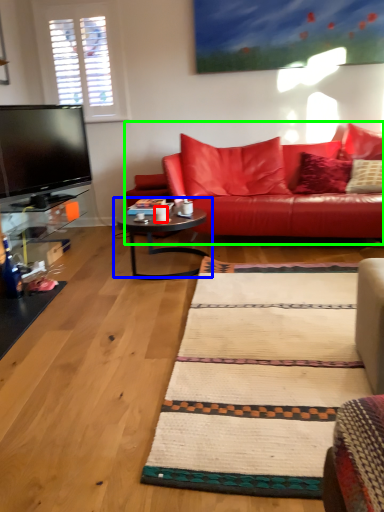
Question: Based on their relative distances, which object is nearer to coffee cup (highlighted by a red box)? Choose from coffee table (highlighted by a blue box) and studio couch (highlighted by a green box).

Choices:
 (A) coffee table
 (B) studio couch

Answer: (A)